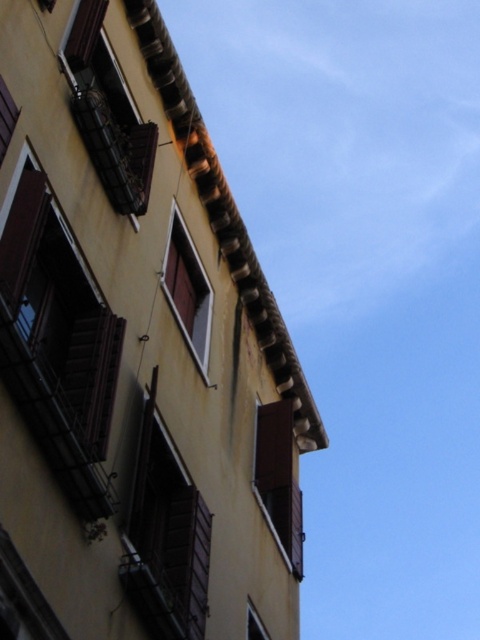
Question: Does brown matte window at center appear under matte brown window at lower center?

Choices:
 (A) yes
 (B) no

Answer: (B)

Question: Is brown wooden window at center further to the viewer compared to brown matte window at center?

Choices:
 (A) no
 (B) yes

Answer: (A)

Question: Estimate the real-world distances between objects in this image. Which object is closer to the brown wooden window at center?

Choices:
 (A) matte brown window at lower center
 (B) matte white window at center
 (C) brown wooden window at left
 (D) wooden at upper left

Answer: (A)

Question: Is brown wooden window at left below brown matte window at center?

Choices:
 (A) no
 (B) yes

Answer: (A)

Question: Which object appears closest to the camera in this image?

Choices:
 (A) matte white window at center
 (B) brown wooden window at left

Answer: (B)

Question: Which object appears farthest from the camera in this image?

Choices:
 (A) matte white window at center
 (B) wooden at upper left
 (C) brown wooden window at left
 (D) brown matte window at center

Answer: (D)